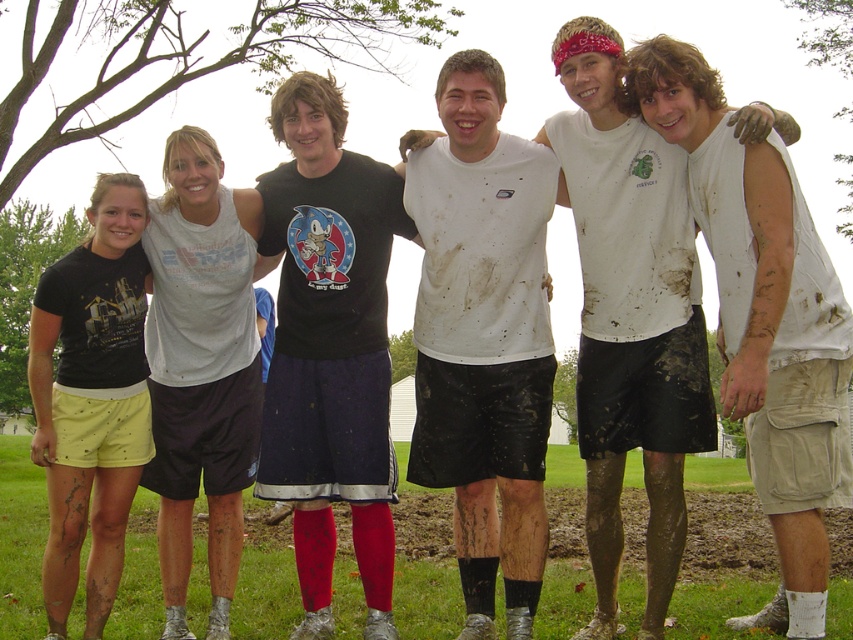
You are a photographer who needs to adjust the camera focus to capture the white matte tank top at center. What are the coordinates where you should focus?

The white matte tank top at center is located at coordinates point (483, 337).